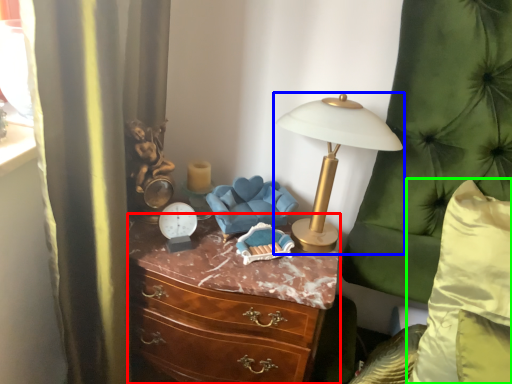
Question: Considering the real-world distances, which object is farthest from chest of drawers (highlighted by a red box)? lamp (highlighted by a blue box) or pillow (highlighted by a green box)?

Choices:
 (A) lamp
 (B) pillow

Answer: (B)